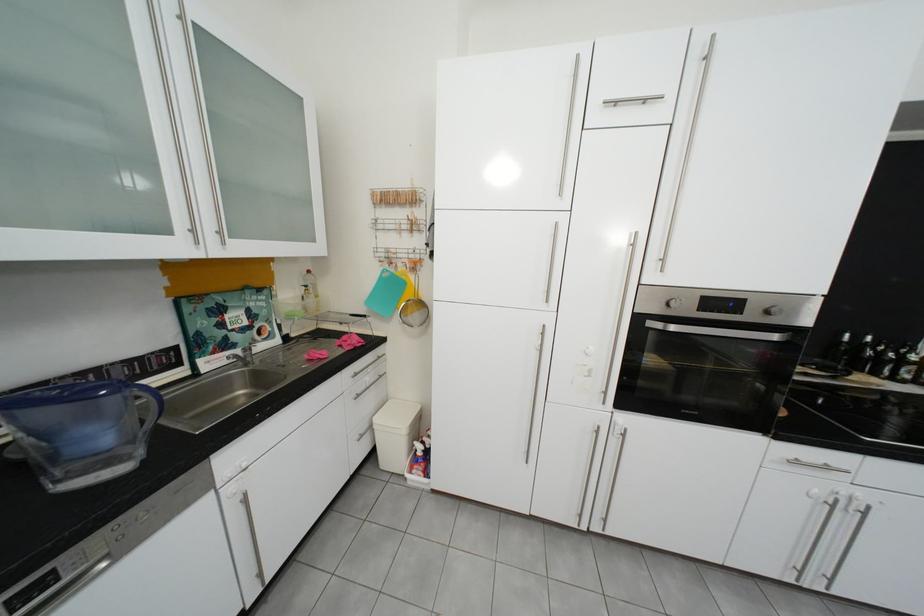
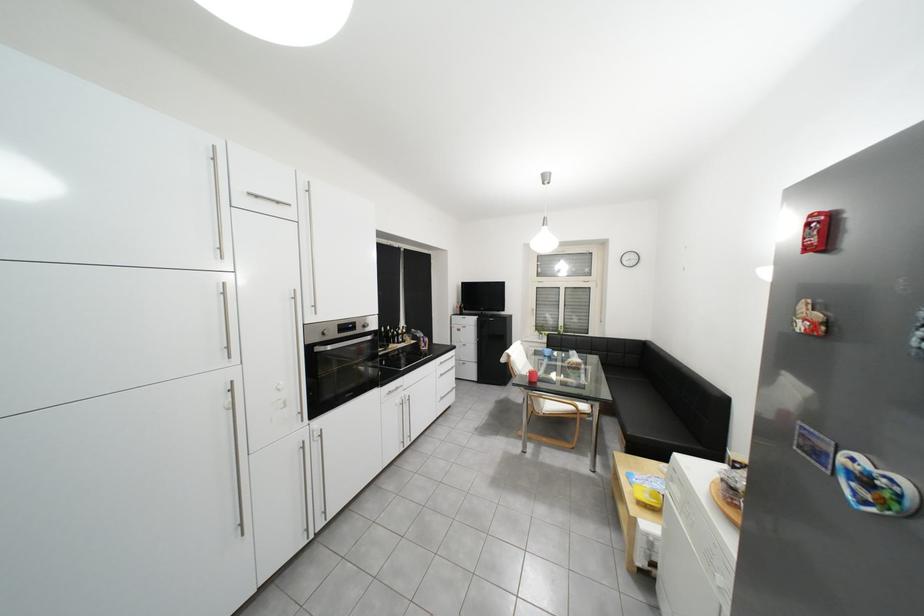
Locate, in the second image, the point that corresponds to point 752,302 in the first image.

(366, 325)